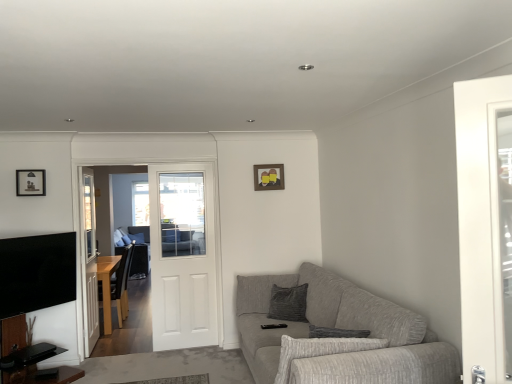
Question: Is wooden photo frame at upper center, acting as the 1th picture frame starting from the back, at the back of white wooden door at center?

Choices:
 (A) no
 (B) yes

Answer: (A)

Question: From the image's perspective, is white wooden door at center over wooden photo frame at upper center, the second picture frame viewed from the front?

Choices:
 (A) yes
 (B) no

Answer: (B)

Question: Can you confirm if white wooden door at center is smaller than wooden photo frame at upper center, the first picture frame when ordered from right to left?

Choices:
 (A) no
 (B) yes

Answer: (A)

Question: Considering the relative sizes of white wooden door at center and wooden photo frame at upper center, the first picture frame when ordered from right to left, in the image provided, is white wooden door at center taller than wooden photo frame at upper center, the first picture frame when ordered from right to left,?

Choices:
 (A) yes
 (B) no

Answer: (A)

Question: Is the depth of white wooden door at center less than that of wooden photo frame at upper center, the 2th picture frame when ordered from left to right?

Choices:
 (A) no
 (B) yes

Answer: (B)

Question: From their relative heights in the image, would you say white wooden door at center is taller or shorter than gray fabric couch at center?

Choices:
 (A) tall
 (B) short

Answer: (A)

Question: From the image's perspective, is white wooden door at center above or below gray fabric couch at center?

Choices:
 (A) below
 (B) above

Answer: (B)

Question: In terms of size, does white wooden door at center appear bigger or smaller than gray fabric couch at center?

Choices:
 (A) small
 (B) big

Answer: (A)

Question: Is white wooden door at center inside or outside of gray fabric couch at center?

Choices:
 (A) outside
 (B) inside

Answer: (A)

Question: In terms of size, does white wooden door at center appear bigger or smaller than wooden photo frame at upper center, acting as the 1th picture frame starting from the back?

Choices:
 (A) big
 (B) small

Answer: (A)

Question: Is white wooden door at center to the left or to the right of wooden photo frame at upper center, the first picture frame when ordered from right to left, in the image?

Choices:
 (A) left
 (B) right

Answer: (A)

Question: From a real-world perspective, relative to wooden photo frame at upper center, acting as the 1th picture frame starting from the back, is white wooden door at center vertically above or below?

Choices:
 (A) above
 (B) below

Answer: (B)

Question: Considering the positions of point (186, 289) and point (278, 170), is point (186, 289) closer or farther from the camera than point (278, 170)?

Choices:
 (A) farther
 (B) closer

Answer: (B)

Question: From their relative heights in the image, would you say wooden photo frame at upper center, the second picture frame viewed from the front, is taller or shorter than textured gray couch at lower right?

Choices:
 (A) short
 (B) tall

Answer: (A)

Question: Is wooden photo frame at upper center, the first picture frame when ordered from right to left, wider or thinner than textured gray couch at lower right?

Choices:
 (A) wide
 (B) thin

Answer: (B)